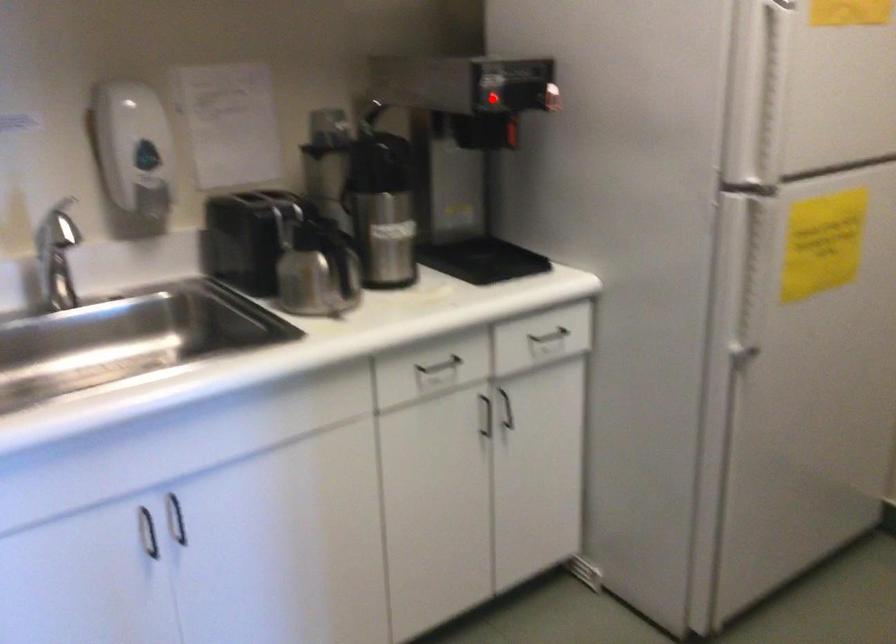
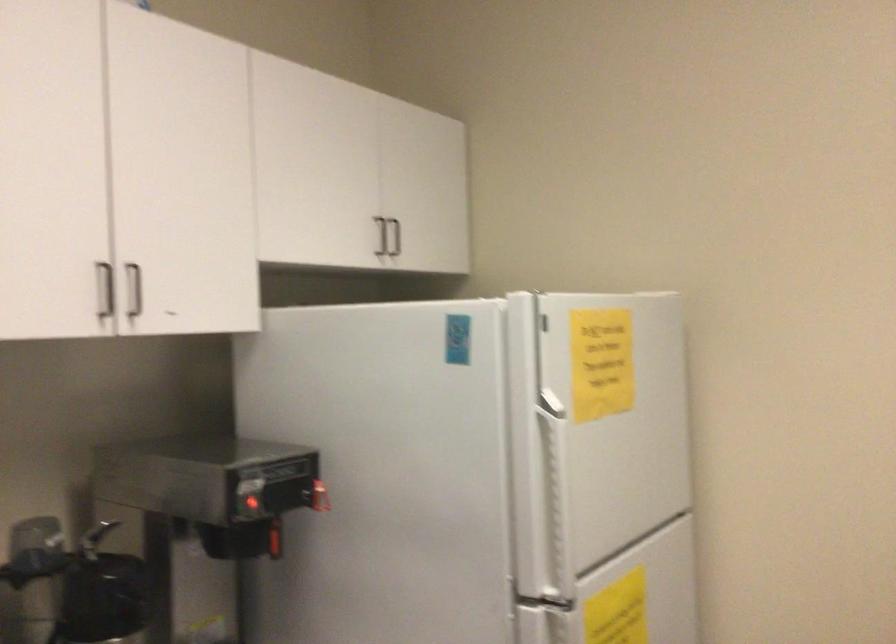
Question: A red point is marked in image1. In image2, is the corresponding 3D point closer to the camera or farther? Reply with the corresponding letter.

Choices:
 (A) The corresponding 3D point is closer.
 (B) The corresponding 3D point is farther.

Answer: (A)